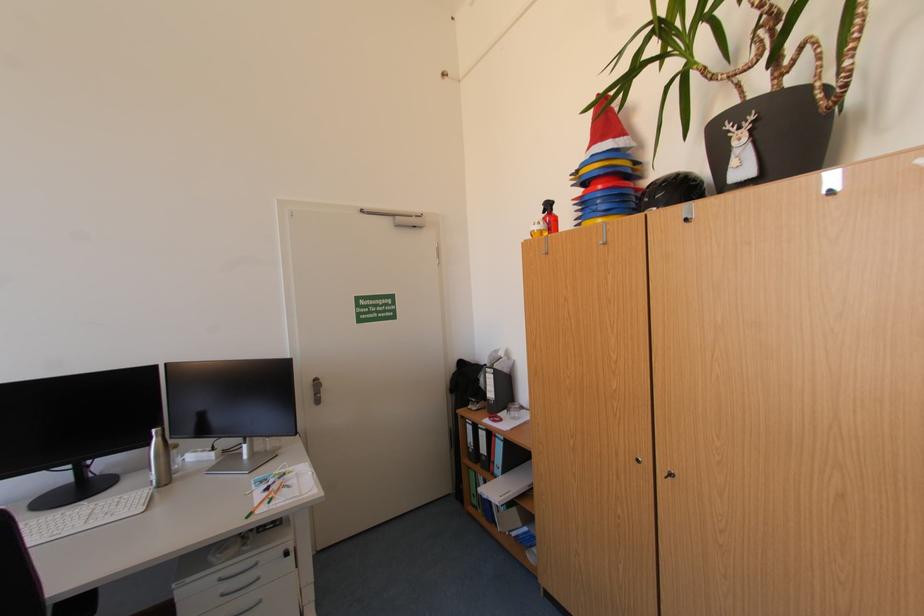
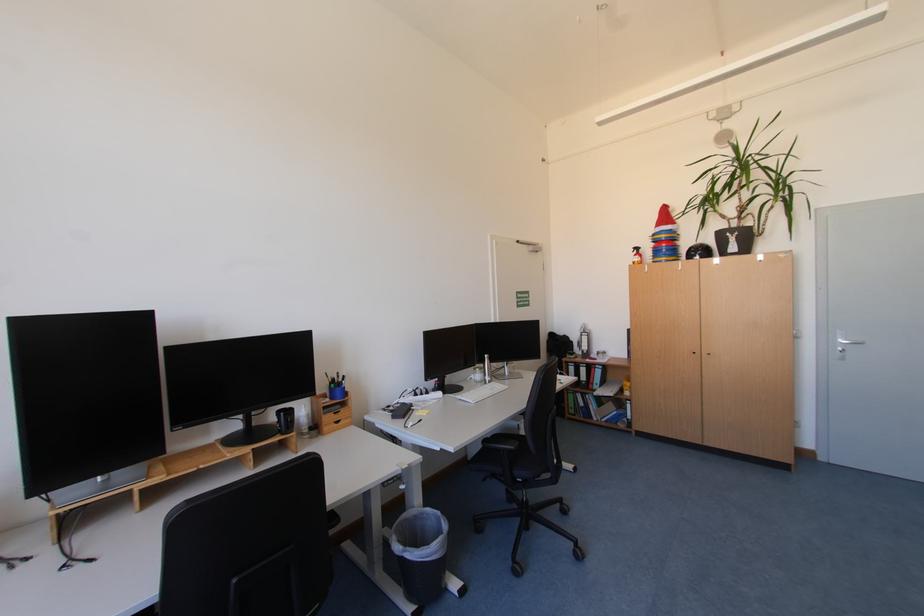
In the second image, find the point that corresponds to pixel 606 203 in the first image.

(672, 252)